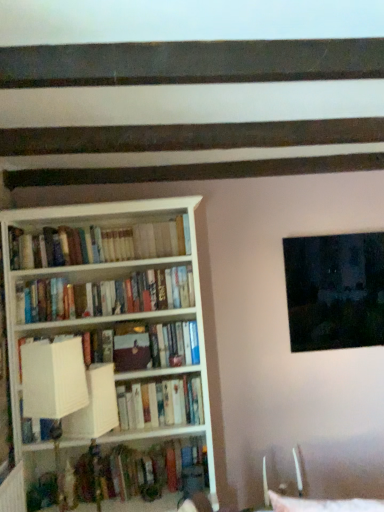
Question: Which direction should I rotate to look at wooden book at lower center, marked as the fourth book in a top-to-bottom arrangement, — up or down?

Choices:
 (A) down
 (B) up

Answer: (A)

Question: Considering the relative positions of metallic silver swivel chair at lower right and wooden book at lower center, marked as the fourth book in a top-to-bottom arrangement, in the image provided, is metallic silver swivel chair at lower right behind wooden book at lower center, marked as the fourth book in a top-to-bottom arrangement,?

Choices:
 (A) yes
 (B) no

Answer: (A)

Question: Can you confirm if metallic silver swivel chair at lower right is wider than wooden book at lower center, marked as the fourth book in a top-to-bottom arrangement?

Choices:
 (A) yes
 (B) no

Answer: (B)

Question: From a real-world perspective, does metallic silver swivel chair at lower right sit lower than wooden book at lower center, marked as the fourth book in a top-to-bottom arrangement?

Choices:
 (A) yes
 (B) no

Answer: (A)

Question: Is metallic silver swivel chair at lower right to the left of wooden book at lower center, which appears as the first book when ordered from the bottom, from the viewer's perspective?

Choices:
 (A) no
 (B) yes

Answer: (A)

Question: Is metallic silver swivel chair at lower right not inside wooden book at lower center, marked as the fourth book in a top-to-bottom arrangement?

Choices:
 (A) no
 (B) yes

Answer: (B)

Question: Is metallic silver swivel chair at lower right aimed at wooden book at lower center, marked as the fourth book in a top-to-bottom arrangement?

Choices:
 (A) no
 (B) yes

Answer: (A)

Question: Is dark matte painting at upper right in front of hardcover books at center, the second book from the top?

Choices:
 (A) no
 (B) yes

Answer: (A)

Question: Does dark matte painting at upper right have a larger size compared to hardcover books at center, the second book from the top?

Choices:
 (A) no
 (B) yes

Answer: (B)

Question: From a real-world perspective, is dark matte painting at upper right located beneath hardcover books at center, which ranks as the third book in bottom-to-top order?

Choices:
 (A) yes
 (B) no

Answer: (A)

Question: Is dark matte painting at upper right with hardcover books at center, which ranks as the third book in bottom-to-top order?

Choices:
 (A) no
 (B) yes

Answer: (A)

Question: From the image's perspective, is dark matte painting at upper right over hardcover books at center, the second book from the top?

Choices:
 (A) no
 (B) yes

Answer: (B)

Question: Is dark matte painting at upper right smaller than hardcover books at center, which ranks as the third book in bottom-to-top order?

Choices:
 (A) no
 (B) yes

Answer: (A)

Question: Is hardcover books at center, which ranks as the third book in bottom-to-top order, positioned in front of dark matte painting at upper right?

Choices:
 (A) no
 (B) yes

Answer: (B)